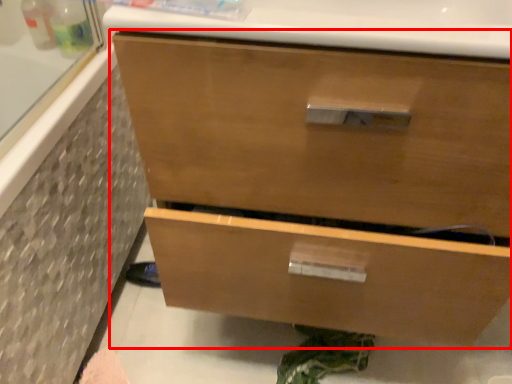
Question: From the image's perspective, considering the relative positions of chest of drawers (annotated by the red box) and bath in the image provided, where is chest of drawers (annotated by the red box) located with respect to the staircase?

Choices:
 (A) above
 (B) below

Answer: (A)